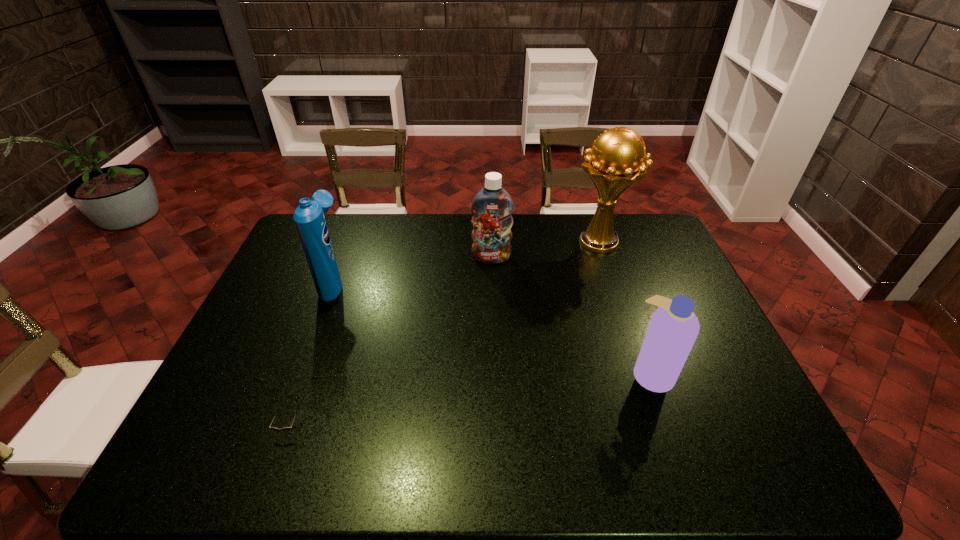
Locate an element on the screen. trophy_cup is located at coordinates (615, 162).

Locate an element on the screen. The image size is (960, 540). the leftmost shampoo is located at coordinates (309, 218).

At what (x,y) coordinates should I click in order to perform the action: click on the third object from right to left. Please return your answer as a coordinate pair (x, y). Looking at the image, I should click on (492, 207).

Identify the location of the fourth farthest object. The image size is (960, 540). (673, 329).

Image resolution: width=960 pixels, height=540 pixels. I want to click on the nearest shampoo, so click(x=673, y=329).

Where is `sunglasses`? sunglasses is located at coordinates (286, 429).

You are a GUI agent. You are given a task and a screenshot of the screen. Output one action in this format:
    pyautogui.click(x=<x>, y=<y>)
    Task: Click on the shortest object
    Image resolution: width=960 pixels, height=540 pixels.
    Given the screenshot: What is the action you would take?
    pyautogui.click(x=286, y=429)

Locate an element on the screen. This screenshot has width=960, height=540. vacant space located at the front of the trophy_cup where the globe is prominent is located at coordinates (611, 277).

The image size is (960, 540). In order to click on vacant area located 0.370m on the front of the leftmost shampoo in this screenshot , I will do `click(286, 410)`.

Where is `free space located on the front label of the second shampoo from left to right`? free space located on the front label of the second shampoo from left to right is located at coordinates (493, 319).